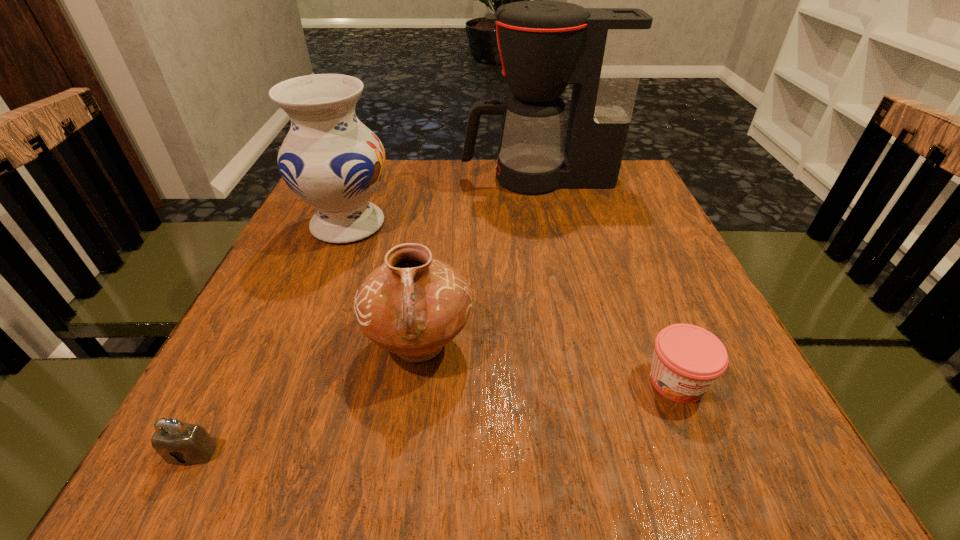
Image resolution: width=960 pixels, height=540 pixels. In order to click on object that is at the far left corner in this screenshot , I will do `click(333, 162)`.

Image resolution: width=960 pixels, height=540 pixels. Identify the location of object that is at the near left corner. (179, 443).

Find the location of a particular element. The image size is (960, 540). object present at the far right corner is located at coordinates (544, 45).

The image size is (960, 540). What are the coordinates of `free space at the far edge` in the screenshot? It's located at (456, 178).

In the image, there is a desktop. In order to click on blank space at the near edge in this screenshot , I will do `click(590, 470)`.

What are the coordinates of `vacant space at the left edge of the desktop` in the screenshot? It's located at click(x=288, y=349).

The image size is (960, 540). Find the location of `free space at the right edge of the desktop`. free space at the right edge of the desktop is located at coordinates (743, 366).

At what (x,y) coordinates should I click in order to perform the action: click on blank space at the far right corner of the desktop. Please return your answer as a coordinate pair (x, y). Looking at the image, I should click on (611, 202).

Where is `vacant area between the jam and the third shortest object`? Image resolution: width=960 pixels, height=540 pixels. vacant area between the jam and the third shortest object is located at coordinates (548, 363).

Find the location of a particular element. This screenshot has height=540, width=960. free spot between the coffee maker and the jam is located at coordinates (607, 280).